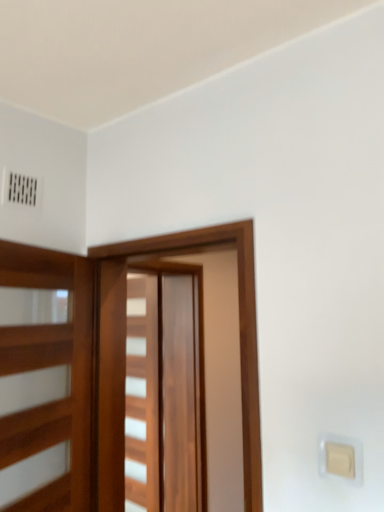
Question: Looking at their shapes, would you say wooden elevator at left is wider or thinner than wooden barn door at center, acting as the second barn door starting from the front?

Choices:
 (A) wide
 (B) thin

Answer: (B)

Question: Considering their positions, is wooden elevator at left located in front of or behind wooden barn door at center, acting as the second barn door starting from the front?

Choices:
 (A) behind
 (B) front

Answer: (B)

Question: Which of these objects is positioned farthest from the wooden barn door at center, which is the 1th barn door in back-to-front order?

Choices:
 (A) wooden elevator at left
 (B) beige plastic light switch at lower right
 (C) wooden barn door at center, the second barn door when ordered from back to front

Answer: (B)

Question: Considering the real-world distances, which object is farthest from the wooden barn door at center, the second barn door when ordered from back to front?

Choices:
 (A) beige plastic light switch at lower right
 (B) wooden barn door at center, acting as the second barn door starting from the front
 (C) wooden elevator at left

Answer: (B)